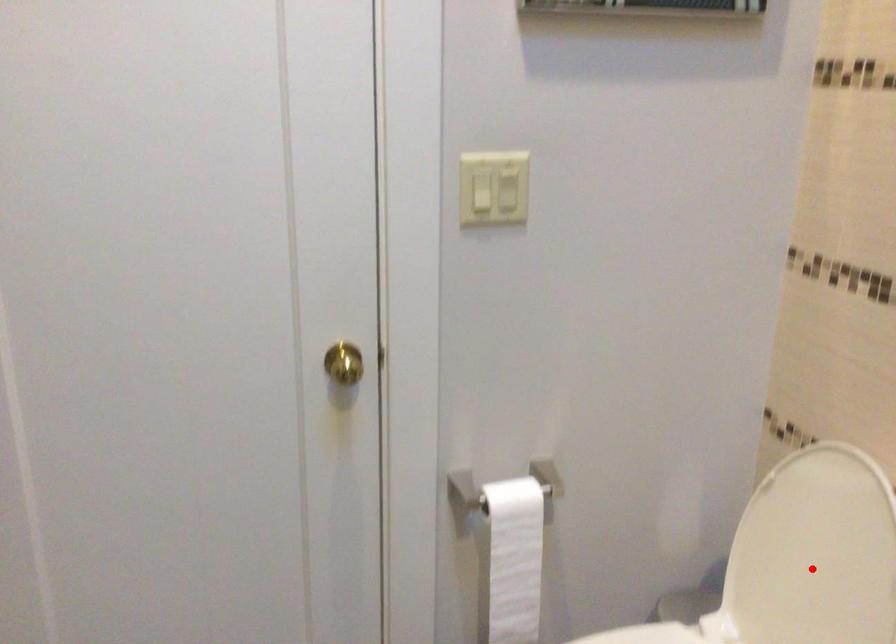
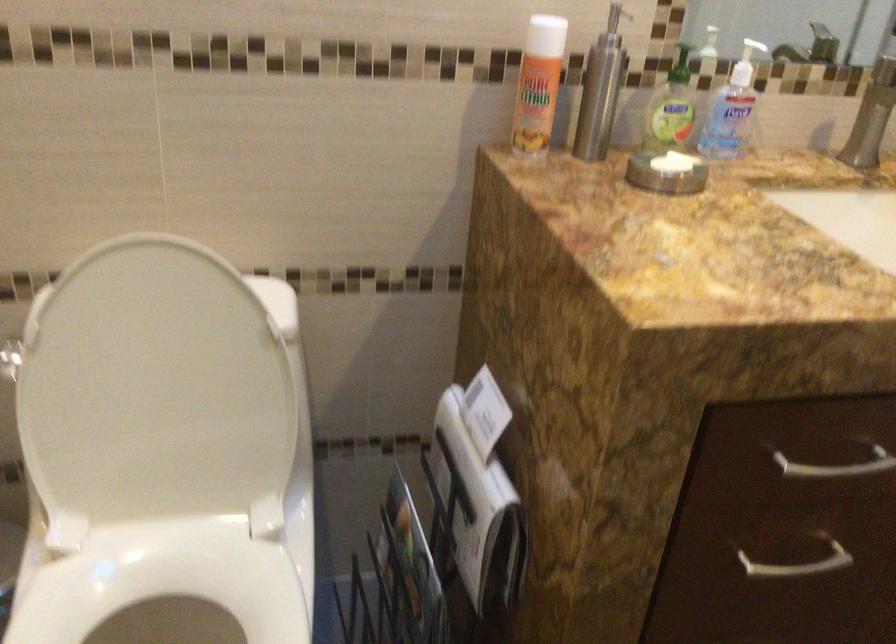
The point at the highlighted location is marked in the first image. Where is the corresponding point in the second image?

(152, 391)